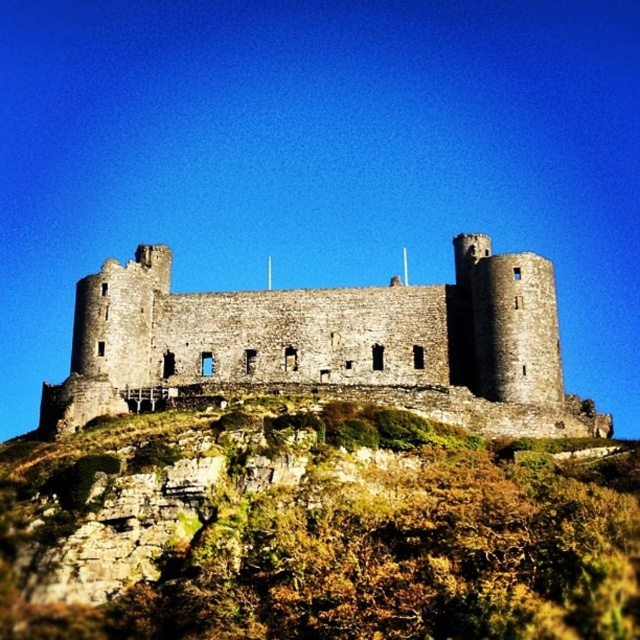
In the scene shown: You are a hiker who has reached the base of the steep slope leading to the stone castle at center. You notice a green mossy rock at center nearby. From your current position at the bottom of the slope, which object is closer to you?

The green mossy rock at center is closer to you since it is positioned under the stone castle at center, meaning it lies between you and the castle on the slope.

You are standing at the base of the castle hill and see two points marked on the castle wall. Which point is closer to you, point (65,488) or point (198,344)?

Point (65,488) is closer to the viewer than point (198,344).